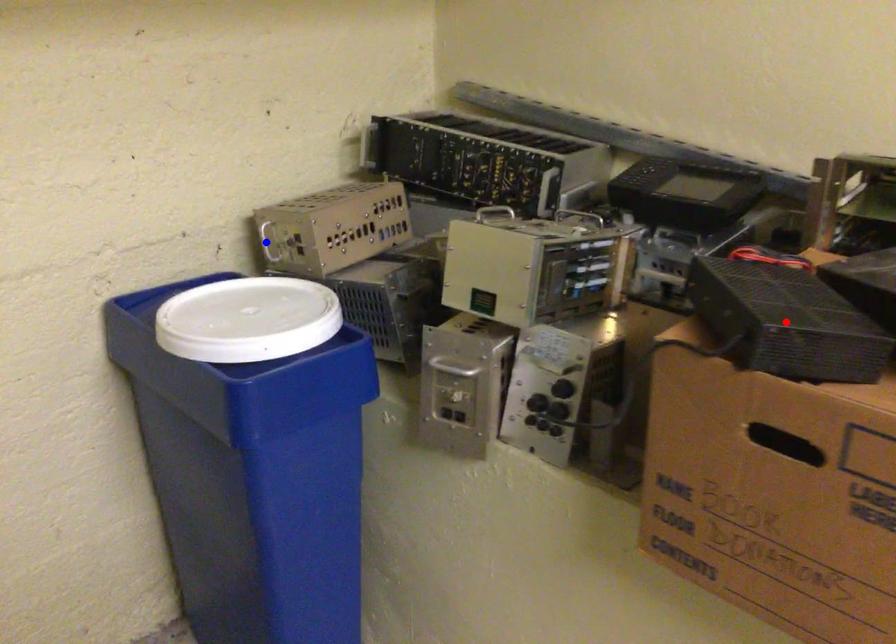
Question: Two points are marked on the image. Which point is closer to the camera?

Choices:
 (A) Blue point is closer.
 (B) Red point is closer.

Answer: (B)